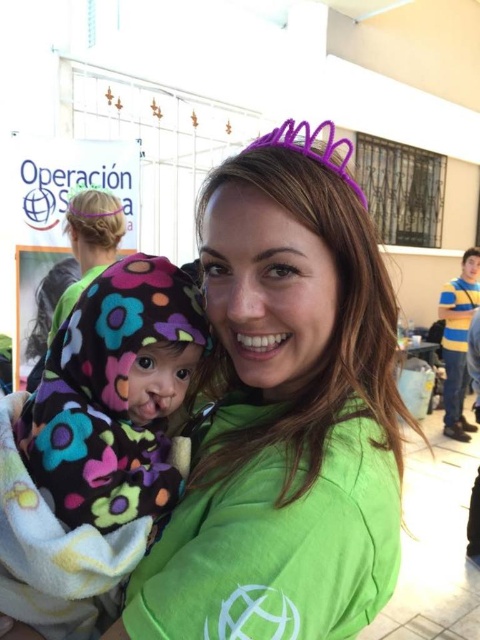
Question: Which point is farther to the camera?

Choices:
 (A) green matte shirt at center
 (B) fluffy fleece blanket at center

Answer: (B)

Question: Does green matte shirt at center appear on the right side of fluffy fleece blanket at center?

Choices:
 (A) yes
 (B) no

Answer: (A)

Question: Which object is farther from the camera taking this photo?

Choices:
 (A) green matte shirt at center
 (B) fluffy fleece blanket at center

Answer: (B)

Question: Which point is closer to the camera taking this photo?

Choices:
 (A) (117, 412)
 (B) (235, 576)

Answer: (B)

Question: Does green matte shirt at center have a greater width compared to fluffy fleece blanket at center?

Choices:
 (A) no
 (B) yes

Answer: (B)

Question: Does green matte shirt at center appear on the right side of fluffy fleece blanket at center?

Choices:
 (A) no
 (B) yes

Answer: (B)